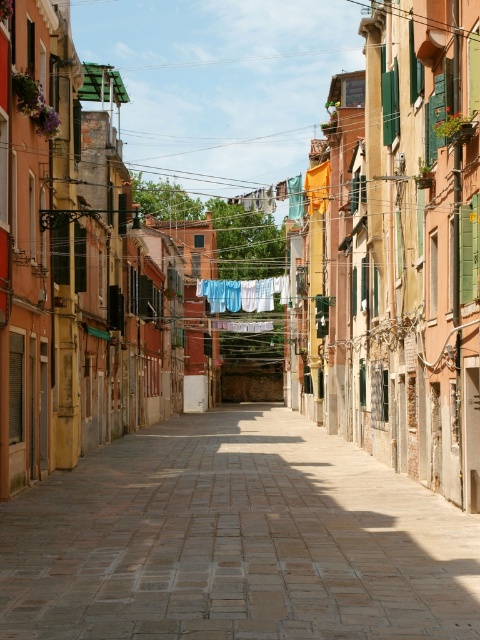
Question: Is brick paved alley at center thinner than blue fabric at center?

Choices:
 (A) no
 (B) yes

Answer: (A)

Question: Which of the following is the closest to the observer?

Choices:
 (A) blue fabric at center
 (B) brick paved alley at center

Answer: (B)

Question: Is brick paved alley at center smaller than blue fabric at center?

Choices:
 (A) yes
 (B) no

Answer: (B)

Question: Can you confirm if brick paved alley at center is positioned below blue fabric at center?

Choices:
 (A) no
 (B) yes

Answer: (B)

Question: Which point appears farthest from the camera in this image?

Choices:
 (A) (208, 298)
 (B) (436, 637)

Answer: (A)